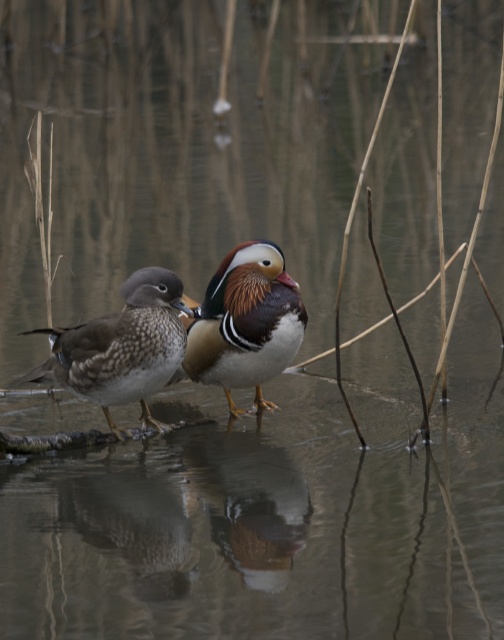
Who is lower down, speckled feather duck at left or shiny brown duck at center?

speckled feather duck at left is below.

Is speckled feather duck at left thinner than shiny brown duck at center?

In fact, speckled feather duck at left might be wider than shiny brown duck at center.

At what (x,y) coordinates should I click in order to perform the action: click on speckled feather duck at left. Please return your answer as a coordinate pair (x, y). The height and width of the screenshot is (640, 504). Looking at the image, I should click on (120, 348).

Locate an element on the screen. speckled feather duck at left is located at coordinates (120, 348).